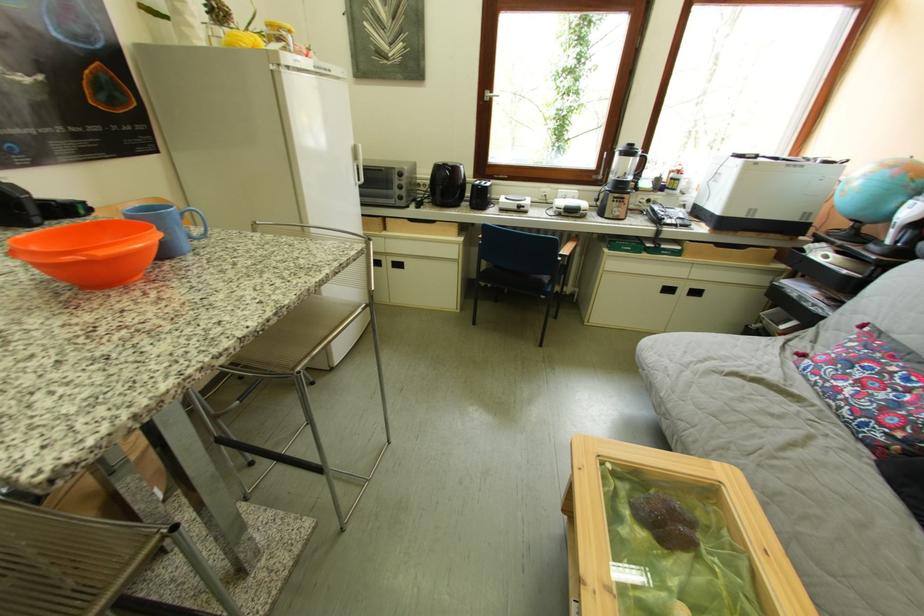
Locate an element on the screen. This screenshot has width=924, height=616. blue chair sitting surface is located at coordinates (515, 277).